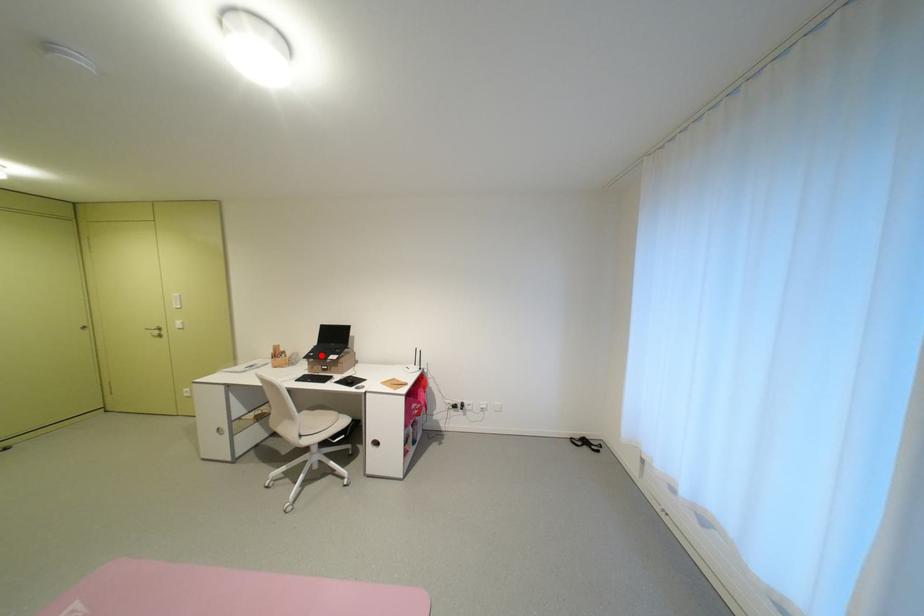
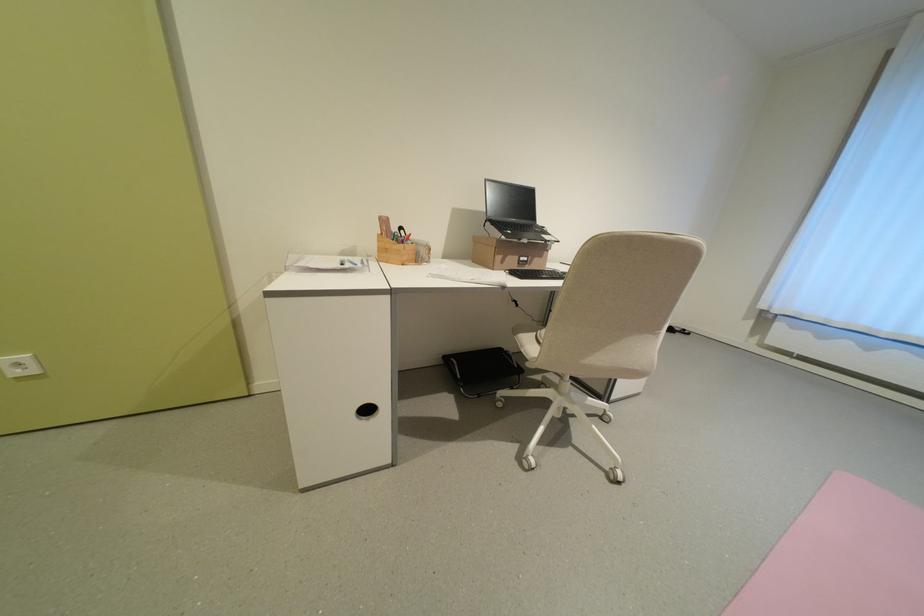
Question: I am providing you with two images of the same scene from different viewpoints. In image1, a red point is highlighted. Considering the same 3D point in image2, which of the following is correct?

Choices:
 (A) It is closer
 (B) It is farther

Answer: (A)